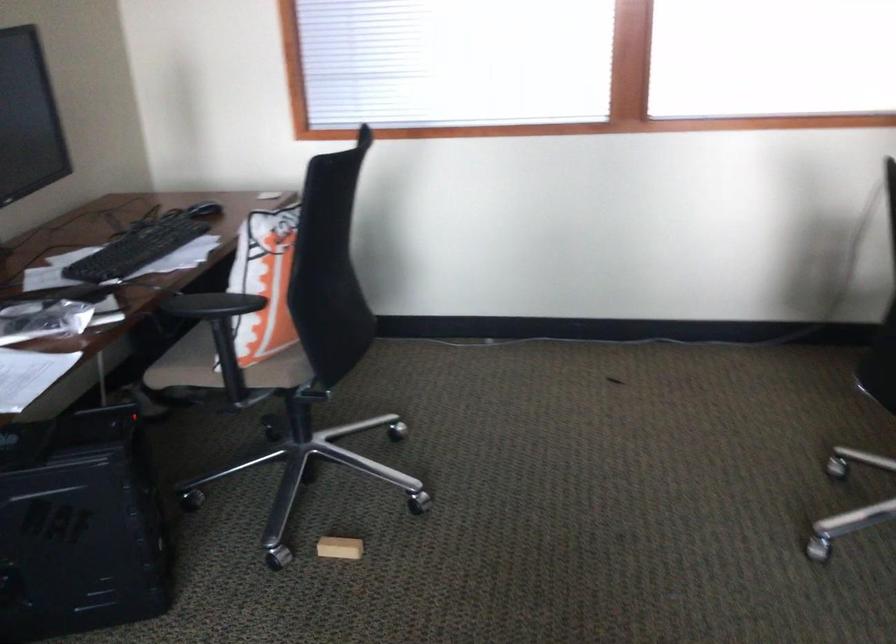
At what (x,y) coordinates should I click in order to perform the action: click on black keyboard. Please return your answer as a coordinate pair (x, y). This screenshot has width=896, height=644. Looking at the image, I should click on (138, 248).